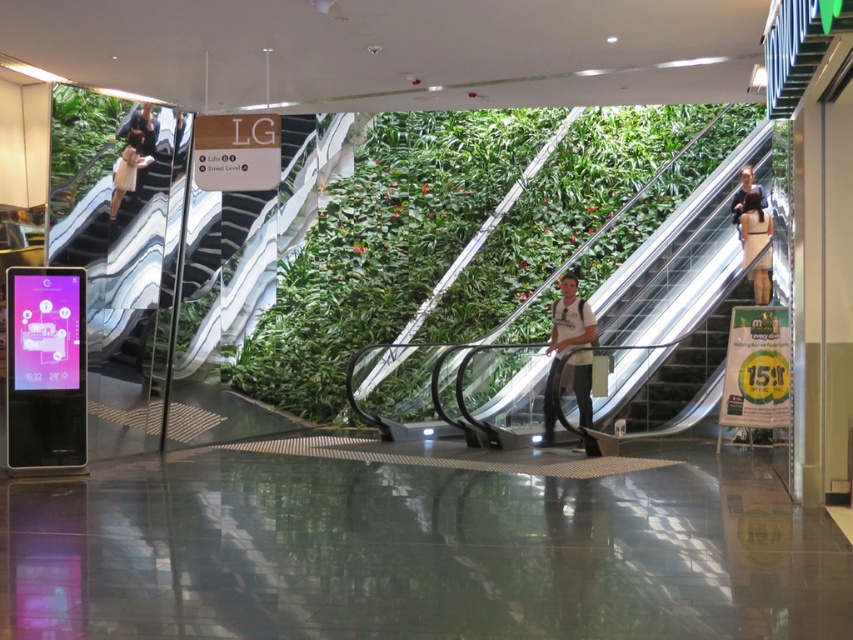
You are a shopper looking for an exit sign. You see the green leafy wall at center and the dark brown leather jacket at upper right. Which object is closer to the exit sign?

The dark brown leather jacket at upper right is behind the green leafy wall at center, so the green leafy wall at center is closer to the exit sign.

You are a customer entering the mall and need to locate the green leafy wall at center and the dark brown leather jacket at upper right. Which object is positioned higher in the image?

The dark brown leather jacket at upper right is positioned higher than the green leafy wall at center in the image.

You are standing in the shopping mall and want to know which of the two points, point [746,237] or point [735,196], is closer to you. Based on the scene description, can you determine which one is nearer?

Point [746,237] is closer to the viewer than point [735,196].